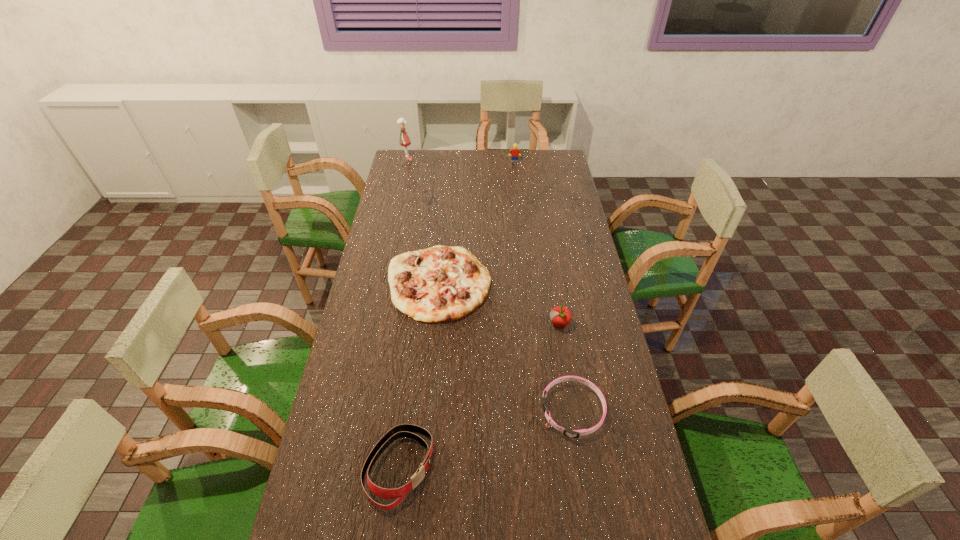
Where is `vacant region located 0.150m on the right of the taller dog collar`? The width and height of the screenshot is (960, 540). vacant region located 0.150m on the right of the taller dog collar is located at coordinates (490, 468).

Image resolution: width=960 pixels, height=540 pixels. What are the coordinates of `free spot located with the buckle on the right dog collar` in the screenshot? It's located at (504, 411).

Image resolution: width=960 pixels, height=540 pixels. Find the location of `vacant space located 0.340m with the buckle on the right dog collar`. vacant space located 0.340m with the buckle on the right dog collar is located at coordinates (423, 411).

You are a GUI agent. You are given a task and a screenshot of the screen. Output one action in this format:
    pyautogui.click(x=<x>, y=<y>)
    Task: Click on the free space located with the buckle on the right dog collar
    The width and height of the screenshot is (960, 540).
    Given the screenshot: What is the action you would take?
    click(x=427, y=411)

The height and width of the screenshot is (540, 960). In order to click on free space located 0.050m on the back of the pizza in this screenshot , I will do `click(444, 239)`.

Identify the location of doll that is at the far edge. Image resolution: width=960 pixels, height=540 pixels. (404, 140).

The image size is (960, 540). What are the coordinates of `Lego located in the far edge section of the desktop` in the screenshot? It's located at (515, 152).

At what (x,y) coordinates should I click in order to perform the action: click on doll situated at the left edge. Please return your answer as a coordinate pair (x, y). This screenshot has width=960, height=540. Looking at the image, I should click on (404, 140).

You are a GUI agent. You are given a task and a screenshot of the screen. Output one action in this format:
    pyautogui.click(x=<x>, y=<y>)
    Task: Click on the dog collar that is at the left edge
    This screenshot has width=960, height=540.
    Given the screenshot: What is the action you would take?
    pyautogui.click(x=400, y=431)

Locate an element on the screen. pizza located in the left edge section of the desktop is located at coordinates (441, 283).